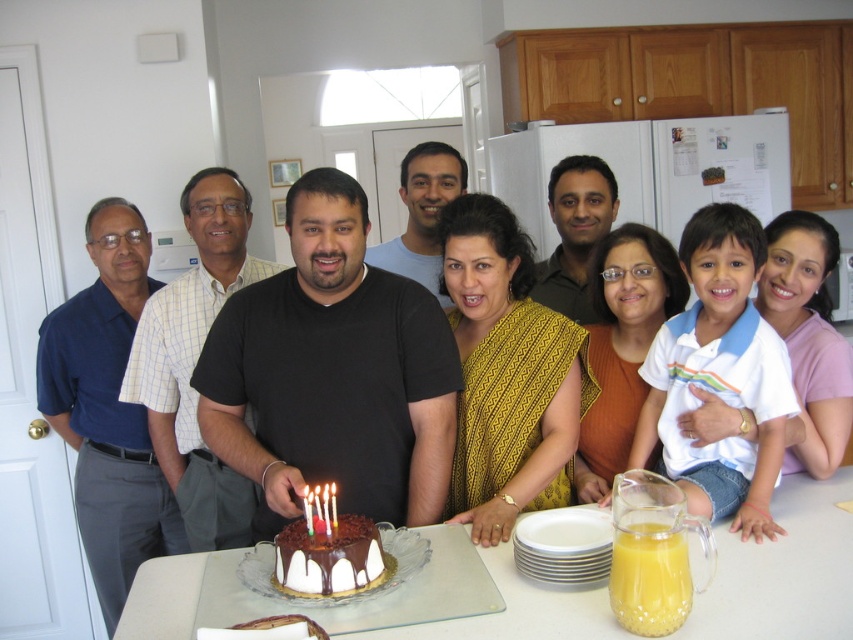
You are a guest at the birthday party and want to grab a drink from the translucent glass pitcher at lower right. To reach it, you need to move around the white glass table at center. Which direction should you walk around the table to get to the pitcher?

The translucent glass pitcher at lower right is behind the white glass table at center, so you should walk around the back side of the white glass table at center to reach it.

You are a guest at the birthday party and want to place your drink on the table. Can you fit your drink on the white glass table at center without it overlapping with the translucent glass pitcher at lower right?

The white glass table at center is larger in size than the translucent glass pitcher at lower right, so yes, you can place your drink on the white glass table at center without overlapping the pitcher.

Please provide the 2D coordinates of the matte black shirt at center in the image. The coordinates are represented as a pair of values between 0 and 1, where 0 is the top left corner and 1 is the bottom right corner of the image. The first value represents the horizontal position and the second value represents the vertical position. The question must mention the object labels exactly as given in the Objects section. Please answer with the coordinates in the format of a tuple with two decimal places, e.g.,

The coordinates of the matte black shirt at center are at point (790, 570). Therefore, the 2D coordinates are approximately 0.89 and 0.93.